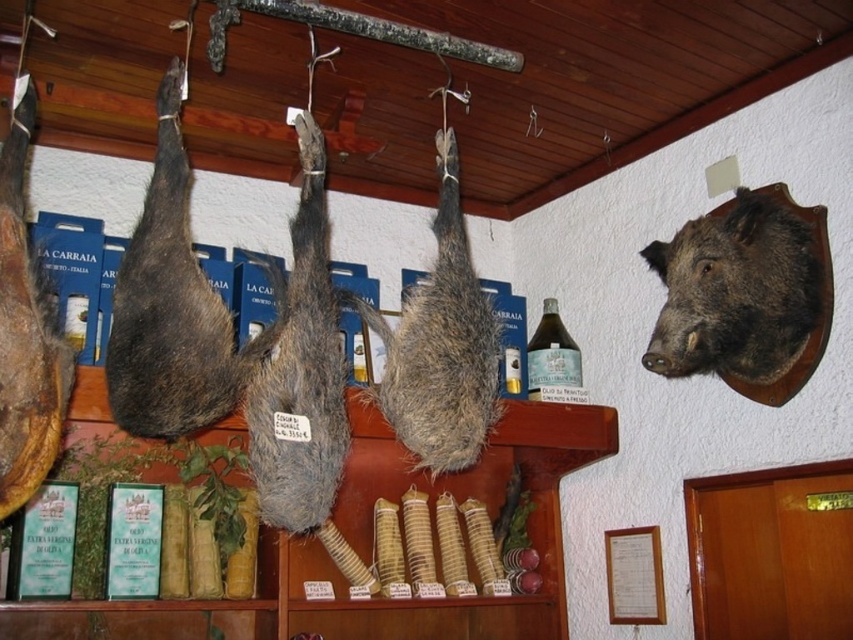
Does brown furry ham at upper left have a lesser width compared to fuzzy fur boar at center?

Yes.

Is brown furry ham at upper left further to the viewer compared to fuzzy fur boar at center?

No, it is not.

Does point (210, 364) come farther from viewer compared to point (387, 360)?

No, it is in front of (387, 360).

At what (x,y) coordinates should I click in order to perform the action: click on brown furry ham at upper left. Please return your answer as a coordinate pair (x, y). Looking at the image, I should click on (173, 307).

Can you confirm if brown furry ham at upper left is bigger than dark brown fur head at upper right?

Yes, brown furry ham at upper left is bigger than dark brown fur head at upper right.

Where is `brown furry ham at upper left`? This screenshot has height=640, width=853. brown furry ham at upper left is located at coordinates (173, 307).

In order to click on brown furry ham at upper left in this screenshot , I will do `click(173, 307)`.

Is fuzzy fur pig at center bigger than fuzzy fur boar at center?

Actually, fuzzy fur pig at center might be smaller than fuzzy fur boar at center.

Between point (294, 380) and point (468, 449), which one is positioned in front?

Point (294, 380) is in front.

Identify the location of fuzzy fur pig at center. This screenshot has width=853, height=640. (300, 371).